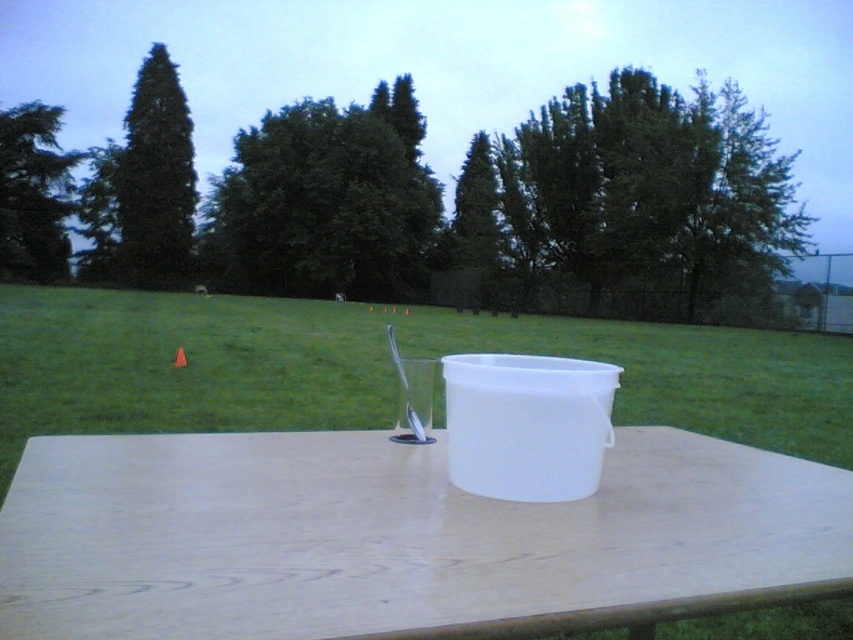
Does white wood table at center have a greater height compared to white plastic bucket at center?

No, white wood table at center is not taller than white plastic bucket at center.

Is white wood table at center bigger than white plastic bucket at center?

Yes, white wood table at center is bigger than white plastic bucket at center.

Measure the distance between white wood table at center and camera.

They are 19.90 inches apart.

This screenshot has height=640, width=853. What are the coordinates of `white wood table at center` in the screenshot? It's located at (399, 538).

Between green grass at center and white plastic bucket at center, which one appears on the right side from the viewer's perspective?

green grass at center is more to the right.

Is green grass at center behind white plastic bucket at center?

Yes.

Where is `green grass at center`? The width and height of the screenshot is (853, 640). green grass at center is located at coordinates (380, 369).

Which is more to the left, white wood table at center or green grass at center?

From the viewer's perspective, white wood table at center appears more on the left side.

Which is more to the right, white wood table at center or green grass at center?

green grass at center

Locate an element on the screen. This screenshot has height=640, width=853. white wood table at center is located at coordinates (399, 538).